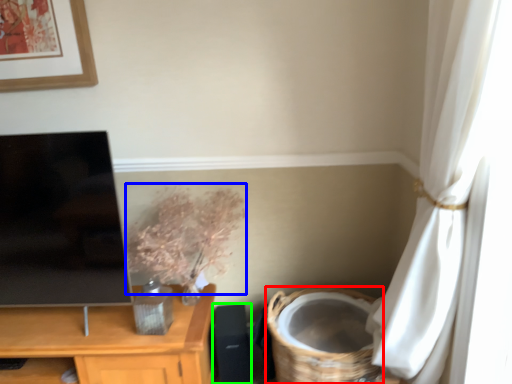
Question: Which object is the closest to the basket (highlighted by a red box)? Choose among these: floral arrangement (highlighted by a blue box) or speaker (highlighted by a green box).

Choices:
 (A) floral arrangement
 (B) speaker

Answer: (B)